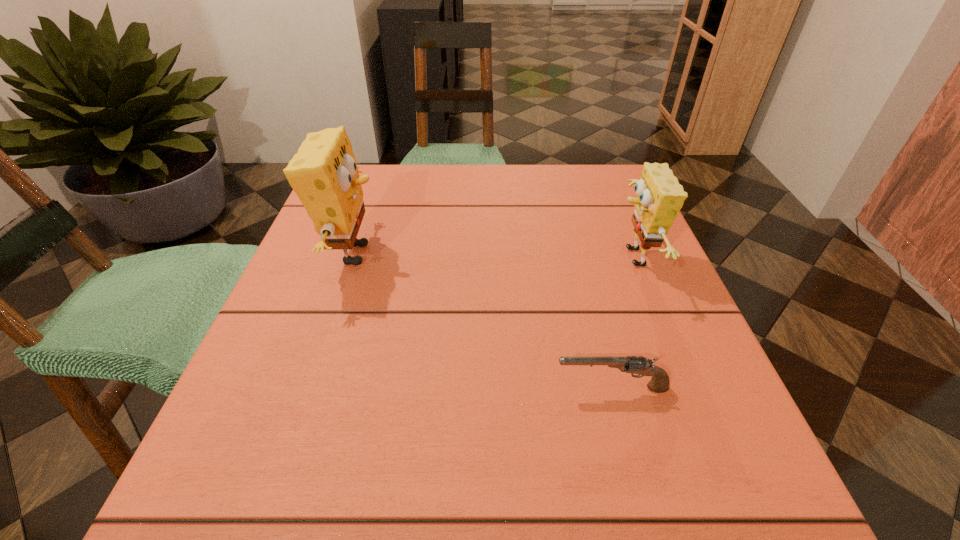
The height and width of the screenshot is (540, 960). I want to click on free space between the right sponge and the gun, so click(x=622, y=323).

You are a GUI agent. You are given a task and a screenshot of the screen. Output one action in this format:
    pyautogui.click(x=<x>, y=<y>)
    Task: Click on the free area in between the right sponge and the taller sponge
    The width and height of the screenshot is (960, 540).
    Given the screenshot: What is the action you would take?
    pyautogui.click(x=493, y=256)

Locate an element on the screen. free spot between the second shortest object and the leftmost object is located at coordinates (493, 256).

At what (x,y) coordinates should I click in order to perform the action: click on vacant area that lies between the second shortest object and the tallest object. Please return your answer as a coordinate pair (x, y). The width and height of the screenshot is (960, 540). Looking at the image, I should click on (493, 256).

Identify which object is the second closest to the nearest object. Please provide its 2D coordinates. Your answer should be formatted as a tuple, i.e. [(x, y)], where the tuple contains the x and y coordinates of a point satisfying the conditions above.

[(324, 174)]

Where is `object that stands as the second closest to the leftmost object`? object that stands as the second closest to the leftmost object is located at coordinates tap(659, 198).